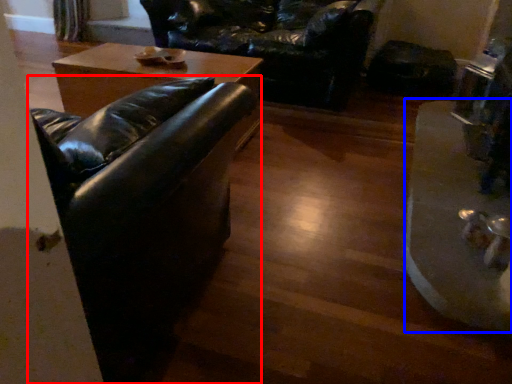
Question: Which object appears closest to the camera in this image, studio couch (highlighted by a red box) or wide (highlighted by a blue box)?

Choices:
 (A) studio couch
 (B) wide

Answer: (A)